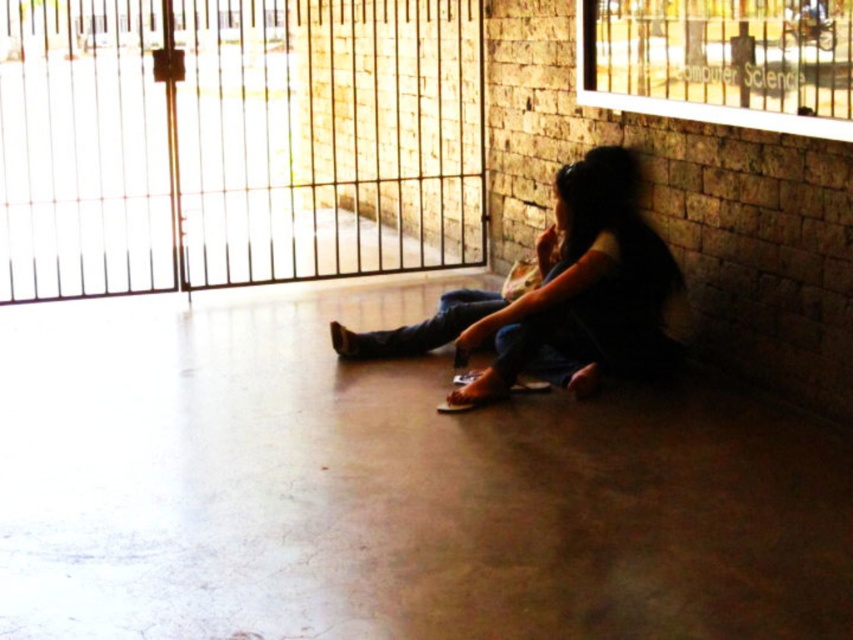
Who is positioned more to the right, dark brown leather sandals at lower center or jeans at center?

From the viewer's perspective, dark brown leather sandals at lower center appears more on the right side.

Where is `dark brown leather sandals at lower center`? This screenshot has width=853, height=640. dark brown leather sandals at lower center is located at coordinates (585, 285).

Find the location of a particular element. The width and height of the screenshot is (853, 640). dark brown leather sandals at lower center is located at coordinates (585, 285).

The width and height of the screenshot is (853, 640). I want to click on dark brown leather sandals at lower center, so click(x=585, y=285).

Who is lower down, black metal gate at upper left or dark brown leather sandals at lower center?

dark brown leather sandals at lower center is below.

The image size is (853, 640). I want to click on black metal gate at upper left, so click(235, 141).

Between black metal gate at upper left and jeans at center, which one is positioned higher?

black metal gate at upper left

Image resolution: width=853 pixels, height=640 pixels. What do you see at coordinates (235, 141) in the screenshot?
I see `black metal gate at upper left` at bounding box center [235, 141].

Image resolution: width=853 pixels, height=640 pixels. Describe the element at coordinates (235, 141) in the screenshot. I see `black metal gate at upper left` at that location.

You are a GUI agent. You are given a task and a screenshot of the screen. Output one action in this format:
    pyautogui.click(x=<x>, y=<y>)
    Task: Click on the black metal gate at upper left
    The height and width of the screenshot is (640, 853).
    Given the screenshot: What is the action you would take?
    pyautogui.click(x=235, y=141)